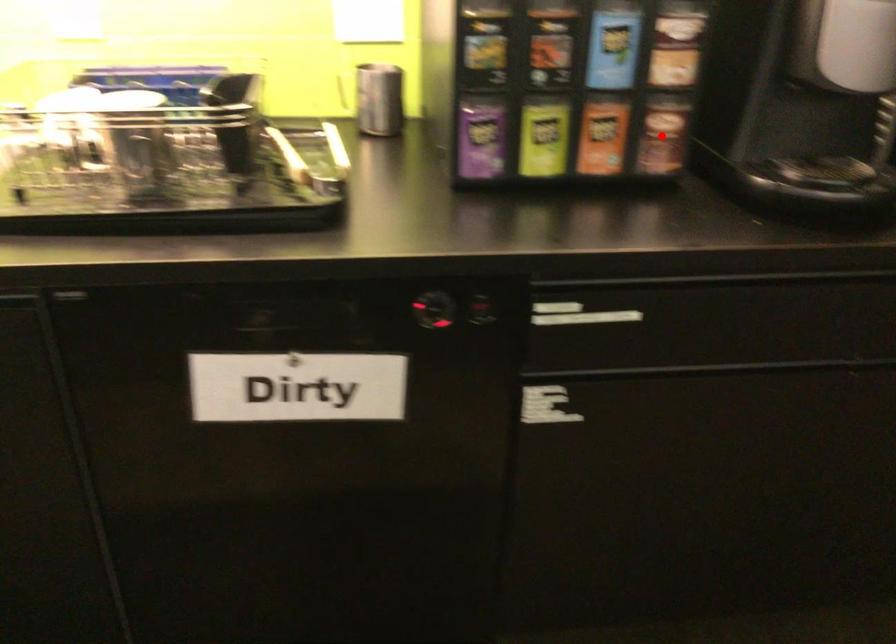
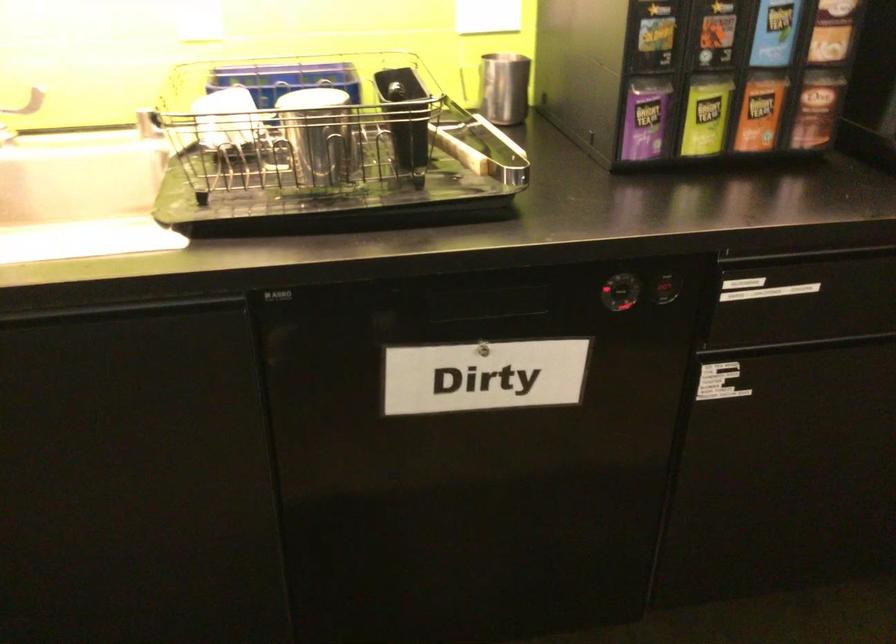
Where in the second image is the point corresponding to the highlighted location from the first image?

(816, 109)